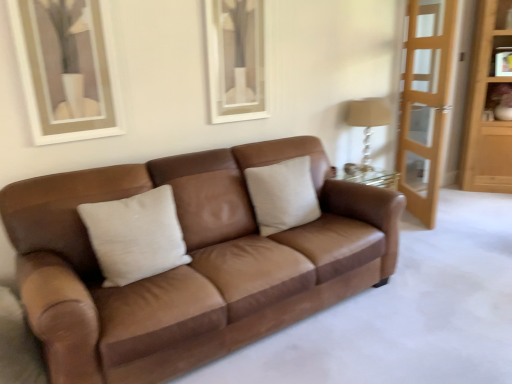
Question: Based on their sizes in the image, would you say beige fabric pillow at center is bigger or smaller than light wood screen door at right?

Choices:
 (A) big
 (B) small

Answer: (B)

Question: Is beige fabric pillow at center spatially inside light wood screen door at right, or outside of it?

Choices:
 (A) inside
 (B) outside

Answer: (B)

Question: Which is nearer to the beige fabric pillow at center?

Choices:
 (A) brown leather couch at center
 (B) light brown wooden dresser at right
 (C) beige fabric lampshade at right
 (D) light wood screen door at right
 (E) matte brown vase at upper right

Answer: (A)

Question: Which of these objects is positioned closest to the beige fabric lampshade at right?

Choices:
 (A) beige fabric pillow at center
 (B) brown leather couch at center
 (C) light brown wooden dresser at right
 (D) matte brown vase at upper right
 (E) light wood screen door at right

Answer: (E)